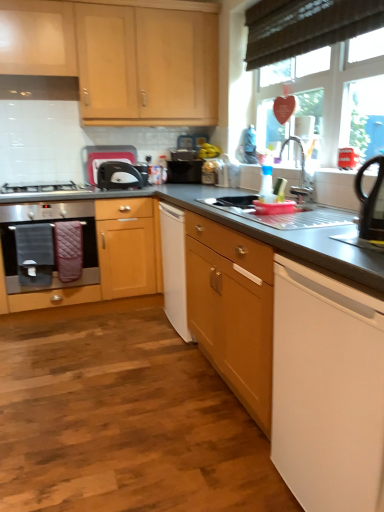
Question: Which is correct: white matte dishwasher at lower right, arranged as the second home appliance when viewed from the back, is inside black plastic kettle at right, the second appliance in the back-to-front sequence, or outside of it?

Choices:
 (A) inside
 (B) outside

Answer: (B)

Question: From their relative heights in the image, would you say white matte dishwasher at lower right, the 2th home appliance from the left, is taller or shorter than black plastic kettle at right, the 2th appliance positioned from the left?

Choices:
 (A) tall
 (B) short

Answer: (A)

Question: Estimate the real-world distances between objects in this image. Which object is farther from the metallic stainless steel sink at center?

Choices:
 (A) metallic faucet at upper right
 (B) stainless steel oven at left, which is the 1th home appliance from back to front
 (C) white plastic toaster at upper center, placed as the first appliance when sorted from left to right
 (D) black plastic kettle at right, placed as the 1th appliance when sorted from right to left
 (E) satin silver gas stove at left

Answer: (E)

Question: Estimate the real-world distances between objects in this image. Which object is farther from the satin silver gas stove at left?

Choices:
 (A) metallic faucet at upper right
 (B) black plastic kettle at right, which appears as the first appliance when ordered from the bottom
 (C) white matte dishwasher at lower right, the 2th home appliance from the left
 (D) stainless steel oven at left, placed as the 2th home appliance when sorted from front to back
 (E) wooden cabinet at left, the first cabinetry when ordered from bottom to top

Answer: (B)